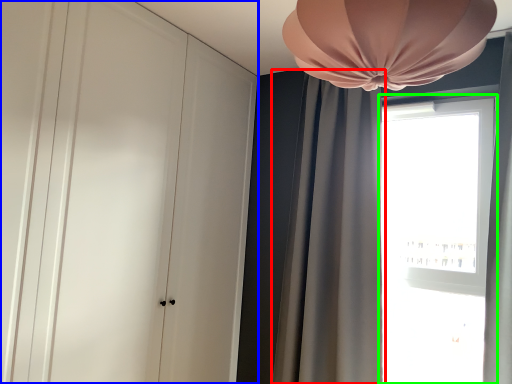
Question: Based on their relative distances, which object is nearer to curtain (highlighted by a red box)? Choose from dresser (highlighted by a blue box) and window (highlighted by a green box).

Choices:
 (A) dresser
 (B) window

Answer: (B)